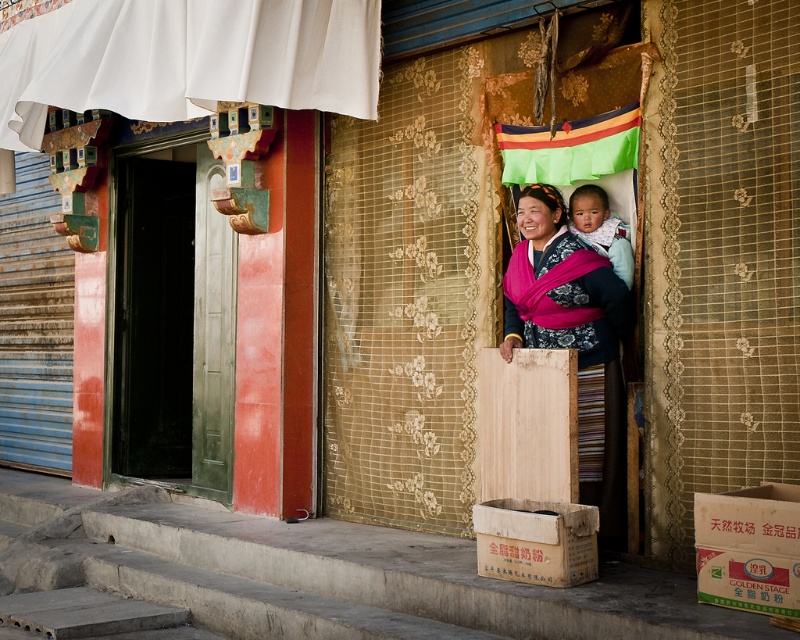
From the picture: Which of these two, gold lace curtain at center or brown cardboard box at lower center, stands taller?

With more height is gold lace curtain at center.

Between gold lace curtain at center and brown cardboard box at lower center, which one appears on the right side from the viewer's perspective?

Positioned to the right is brown cardboard box at lower center.

Who is more forward, (x=332, y=396) or (x=509, y=566)?

Point (x=509, y=566)

Locate an element on the screen. The width and height of the screenshot is (800, 640). gold lace curtain at center is located at coordinates (412, 289).

Which of these two, white fabric curtain at upper left or brown cardboard box at lower center, stands shorter?

brown cardboard box at lower center

Can you confirm if white fabric curtain at upper left is positioned below brown cardboard box at lower center?

No.

At what (x,y) coordinates should I click in order to perform the action: click on white fabric curtain at upper left. Please return your answer as a coordinate pair (x, y). Looking at the image, I should click on (188, 60).

Which is in front, point (750, 593) or point (576, 518)?

Point (750, 593)

Does point (758, 536) come closer to viewer compared to point (550, 577)?

Yes, it is in front of point (550, 577).

Is point (728, 577) more distant than point (574, 541)?

No, (728, 577) is closer to viewer.

Locate an element on the screen. The image size is (800, 640). white cardboard box at lower right is located at coordinates (748, 548).